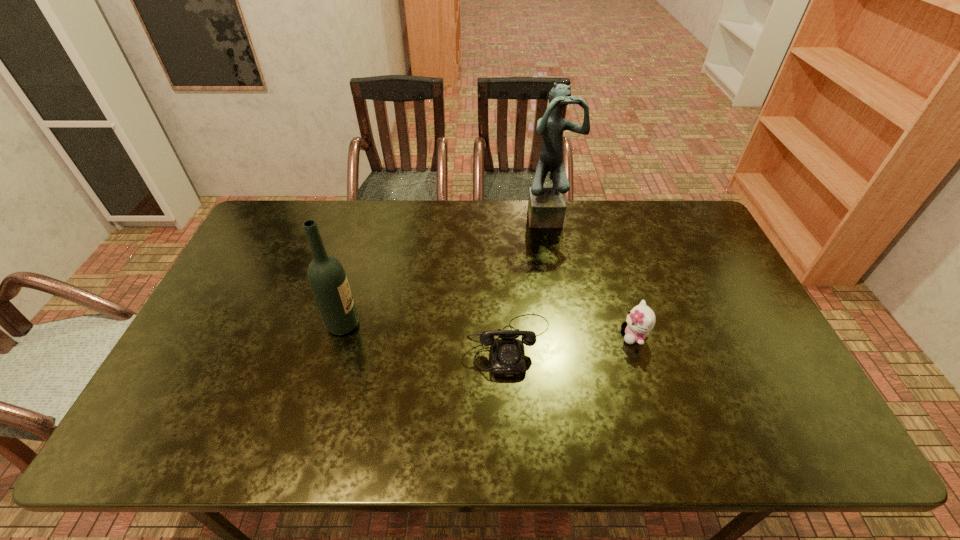
Find the location of a particular element. The image size is (960, 540). free area in between the kitten and the tallest object is located at coordinates [591, 275].

Where is `vacant point located between the rightmost object and the shortest object`? vacant point located between the rightmost object and the shortest object is located at coordinates (572, 340).

You are a GUI agent. You are given a task and a screenshot of the screen. Output one action in this format:
    pyautogui.click(x=<x>, y=<y>)
    Task: Click on the free space between the farthest object and the wine bottle
    
    Given the screenshot: What is the action you would take?
    pyautogui.click(x=446, y=269)

In order to click on free spot between the tallest object and the leftmost object in this screenshot , I will do tap(446, 269).

Where is `free spot between the telephone and the rightmost object`? The width and height of the screenshot is (960, 540). free spot between the telephone and the rightmost object is located at coordinates (572, 340).

Find the location of a particular element. The width and height of the screenshot is (960, 540). vacant space that's between the wine bottle and the tallest object is located at coordinates (446, 269).

I want to click on blank region between the kitten and the second tallest object, so click(x=489, y=330).

You are a GUI agent. You are given a task and a screenshot of the screen. Output one action in this format:
    pyautogui.click(x=<x>, y=<y>)
    Task: Click on the empty space between the shortest object and the tallest object
    The image size is (960, 540).
    Given the screenshot: What is the action you would take?
    pyautogui.click(x=529, y=279)

The width and height of the screenshot is (960, 540). I want to click on vacant space in between the shortest object and the tallest object, so pos(529,279).

Image resolution: width=960 pixels, height=540 pixels. I want to click on object that ranks as the third closest to the rightmost object, so click(327, 278).